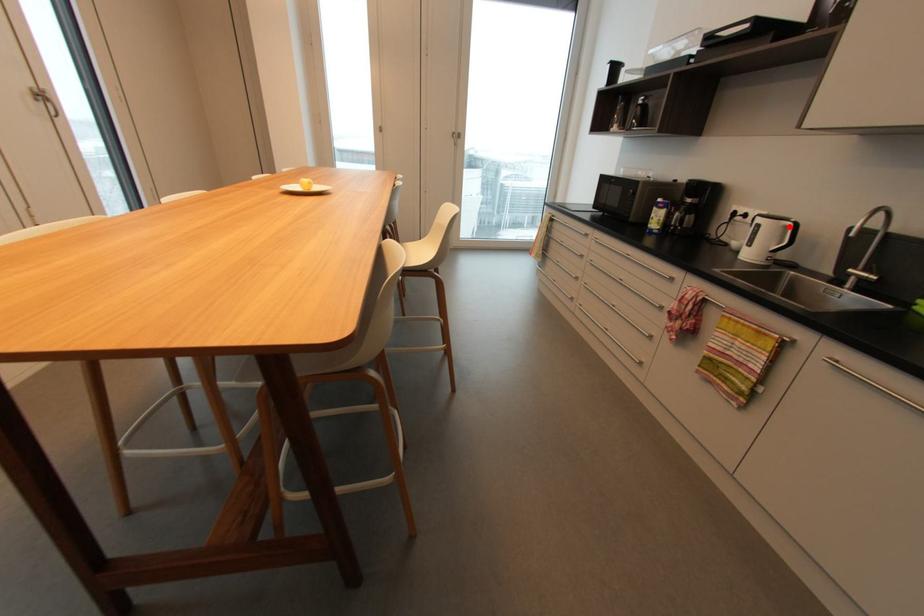
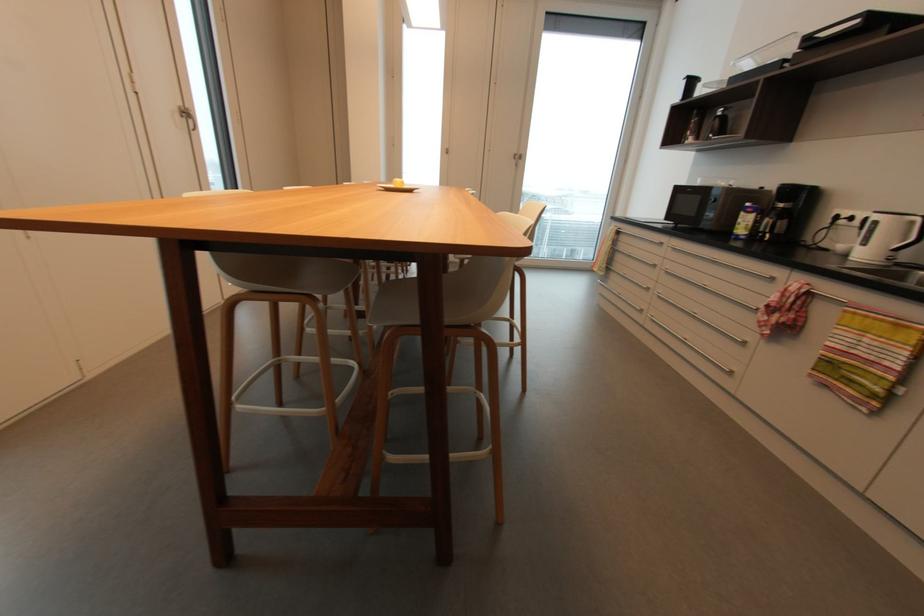
Where in the second image is the point corresponding to the highlighted location from the first image?

(916, 223)